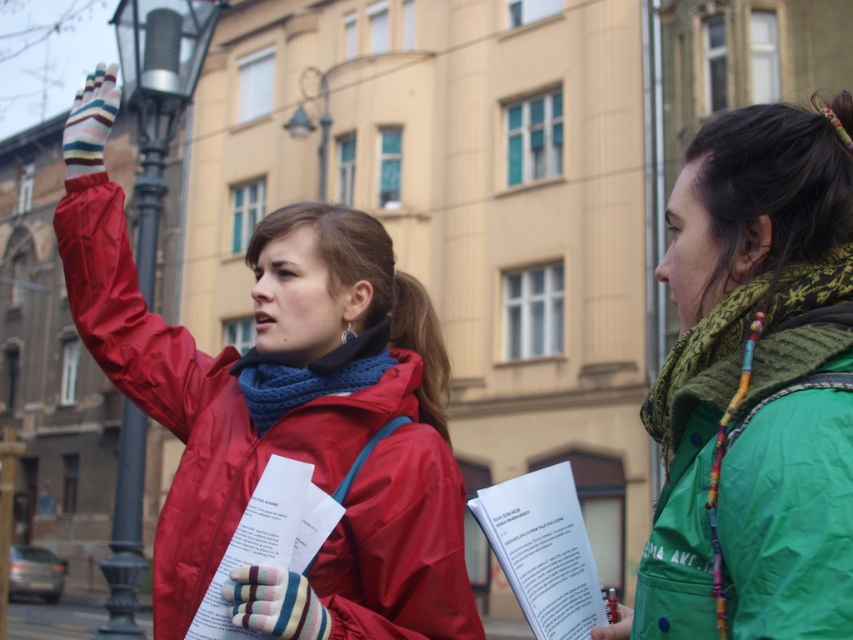
You are a photographer trying to capture a clear photo of the matte red jacket at left and the metallic silver lamp post at left. Which object should you focus on first to ensure both are in focus?

The matte red jacket at left is closer to the viewer than the metallic silver lamp post at left, so you should focus on the matte red jacket at left first to ensure both are in focus.

You are a photographer trying to capture a photo of the green matte jacket at right and the metallic silver lamp post at left. Which object should you focus on first if you want to ensure both are in the frame without moving the camera?

The green matte jacket at right is shorter than the metallic silver lamp post at left, so you should focus on the metallic silver lamp post at left first to ensure it fits within the frame, then adjust for the shorter jacket.

You are a photographer trying to capture both the matte red jacket at left and the metallic silver lamp post at left in a single frame. Based on their sizes, which object should you focus on first to ensure both fit in the photo?

The matte red jacket at left is smaller than the metallic silver lamp post at left, so you should focus on the metallic silver lamp post at left first to accommodate its larger size within the frame.